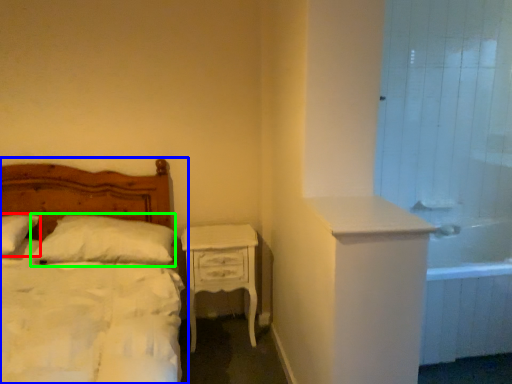
Question: Which is farther away from pillow (highlighted by a red box)? bed (highlighted by a blue box) or pillow (highlighted by a green box)?

Choices:
 (A) bed
 (B) pillow

Answer: (A)